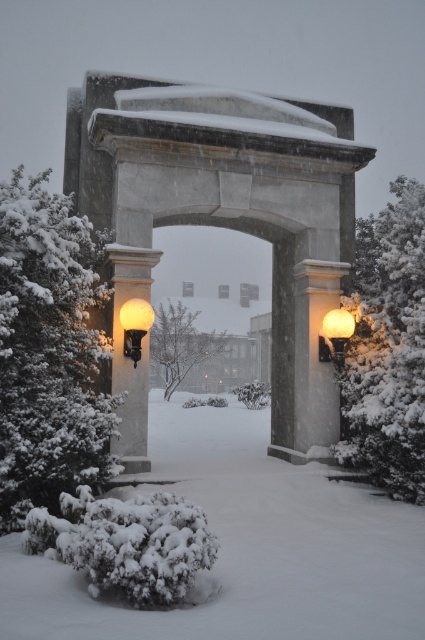
Question: Based on their relative distances, which object is farther from the matte white pillar at left?

Choices:
 (A) white fluffy snow at left
 (B) green leafy tree at center

Answer: (B)

Question: Can you confirm if matte white pillar at left is wider than matte glass globe at left?

Choices:
 (A) yes
 (B) no

Answer: (A)

Question: Which object is the farthest from the matte glass lamp at center?

Choices:
 (A) snow-covered evergreen at right
 (B) green leafy tree at center

Answer: (B)

Question: Which point is closer to the camera taking this photo?

Choices:
 (A) click(x=125, y=288)
 (B) click(x=350, y=326)
 (C) click(x=232, y=593)
 (D) click(x=419, y=477)

Answer: (C)

Question: Is white fluffy snow at left further to the viewer compared to matte white pillar at left?

Choices:
 (A) yes
 (B) no

Answer: (B)

Question: Does green leafy tree at center have a larger size compared to matte glass lamp at center?

Choices:
 (A) no
 (B) yes

Answer: (B)